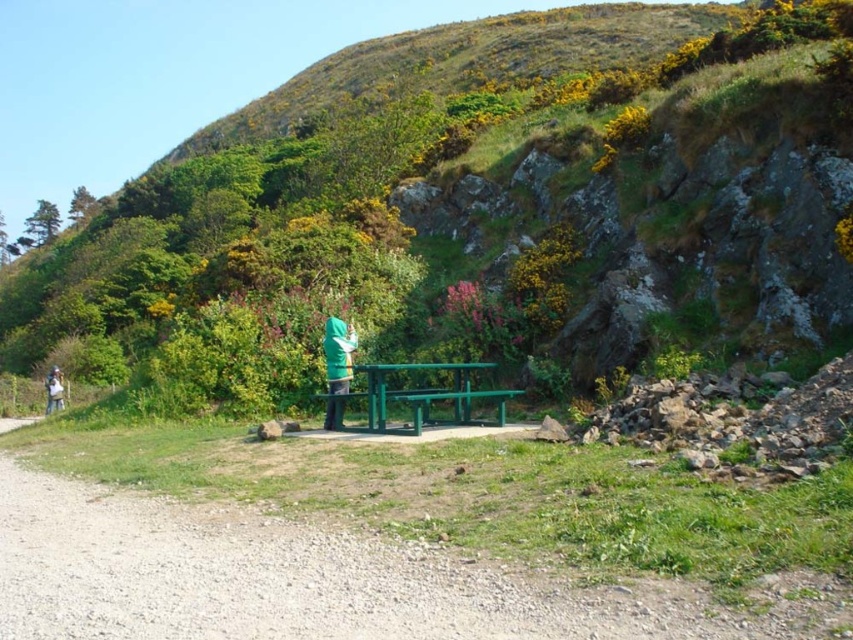
You are standing at the gravel path and want to take a photo of both the green matte jacket at center and the green fabric jacket at center. Which jacket should you focus on first to ensure both are in clear view?

You should focus on the green matte jacket at center first because it is closer to the viewer than the green fabric jacket at center, ensuring both are in clear view when focusing on the closer one first.

You are standing at the gravel path and want to place a small flag at the highest point between the green grassy hillside at center and the green matte jacket at center. Which object should you choose to place the flag on?

The green grassy hillside at center has a greater height compared to the green matte jacket at center, so you should place the flag on the green grassy hillside at center.

You are standing on the gravel path and want to sit down at the green picnic table. Which object, the green grassy hillside at center or the green matte jacket at center, is closer to your left side as you face the picnic table?

The green grassy hillside at center is positioned on the left side of the green matte jacket at center, so as you face the picnic table, the green grassy hillside at center would be closer to your left side.